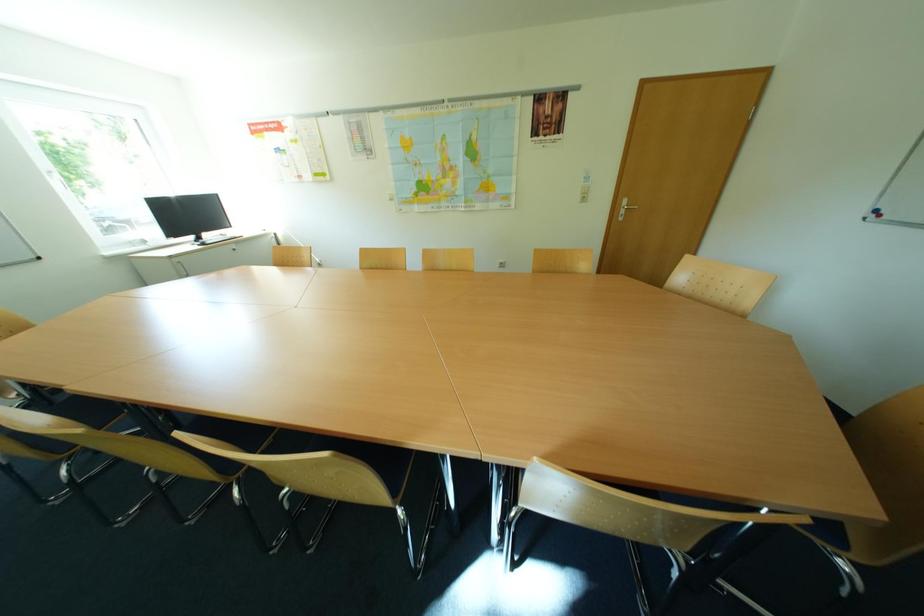
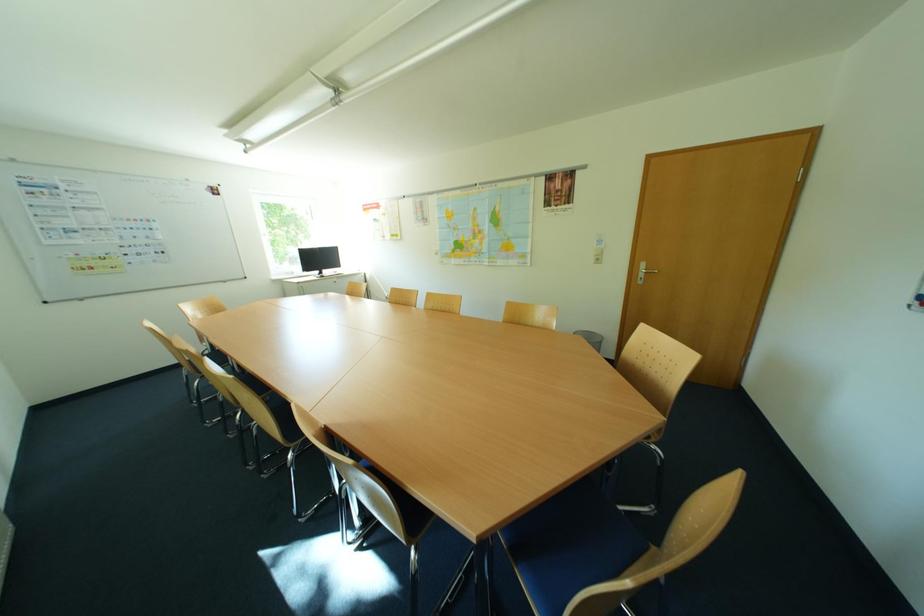
Question: The images are taken continuously from a first-person perspective. In which direction are you moving?

Choices:
 (A) Left
 (B) Right
 (C) Forward
 (D) Backward

Answer: (B)